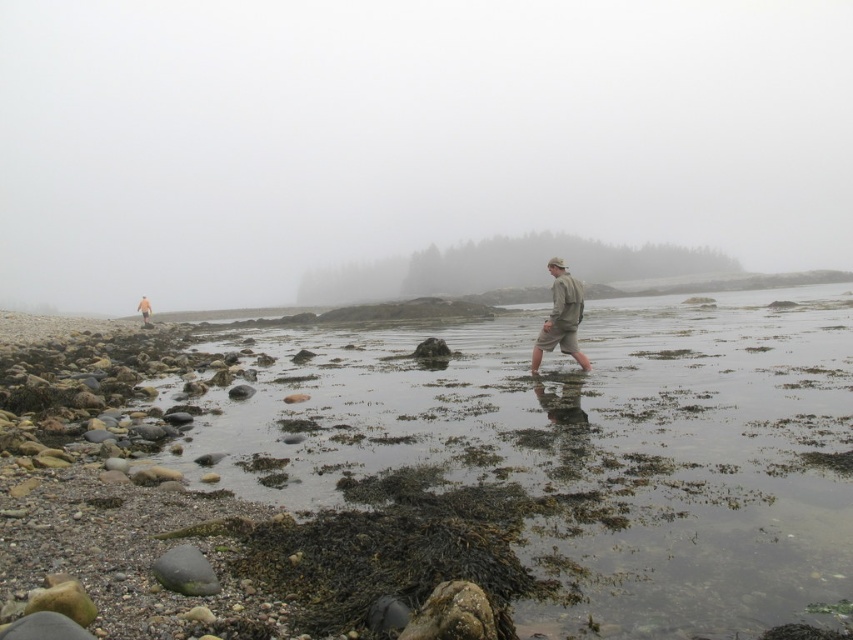
In the scene shown: Is foggy at center further to the viewer compared to camouflage fabric jacket at lower left?

Yes, foggy at center is behind camouflage fabric jacket at lower left.

Which is below, foggy at center or camouflage fabric jacket at lower left?

camouflage fabric jacket at lower left

Which is in front, point (634, 275) or point (138, 307)?

Point (138, 307) is more forward.

The width and height of the screenshot is (853, 640). Identify the location of foggy at center. (503, 268).

Between point (566, 304) and point (146, 304), which one is positioned behind?

The point (146, 304) is more distant.

Is khaki fabric shorts at center wider than camouflage fabric jacket at lower left?

Incorrect, khaki fabric shorts at center's width does not surpass camouflage fabric jacket at lower left's.

Is point (589, 364) farther from viewer compared to point (141, 308)?

No, (589, 364) is in front of (141, 308).

You are a GUI agent. You are given a task and a screenshot of the screen. Output one action in this format:
    pyautogui.click(x=<x>, y=<y>)
    Task: Click on the khaki fabric shorts at center
    This screenshot has height=640, width=853.
    Given the screenshot: What is the action you would take?
    pyautogui.click(x=561, y=317)

Can you confirm if foggy at center is positioned below khaki fabric shorts at center?

No, foggy at center is not below khaki fabric shorts at center.

Looking at this image, can you confirm if foggy at center is taller than khaki fabric shorts at center?

Correct, foggy at center is much taller as khaki fabric shorts at center.

Who is more forward, (485,259) or (554,266)?

Positioned in front is point (554,266).

Locate an element on the screen. foggy at center is located at coordinates (503, 268).